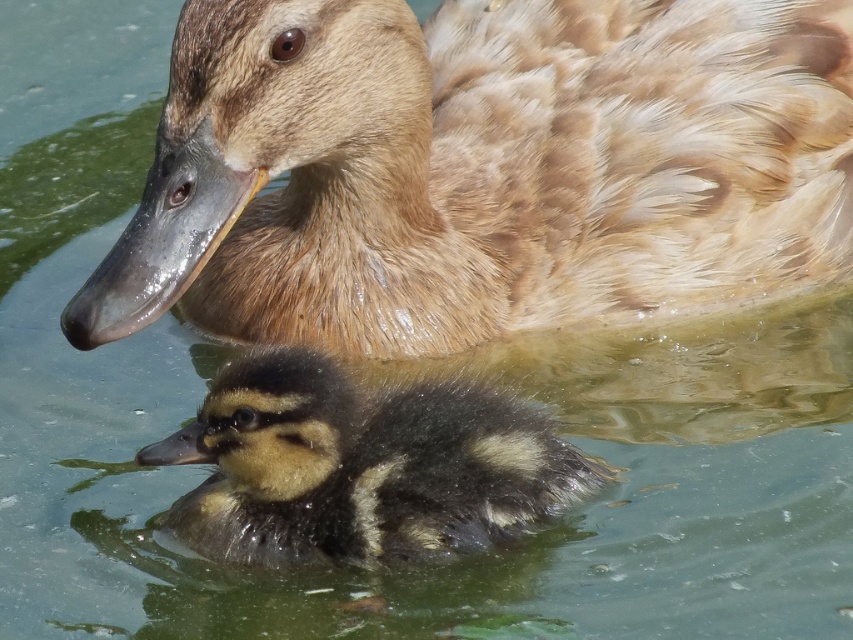
From the picture: You are a photographer trying to capture the brown feathered duck at upper center in the center of your photo. The duck is currently located at point (480, 168). To center it, should you move your camera to the left or right?

The brown feathered duck at upper center is located at point (480, 168). Since the x coordinate is 0.263, which is less than 0.5, you should move your camera to the right to center it.

You are observing a duck and its duckling in the water. The brown feathered duck at upper center and the black fuzzy duckling at center are both in the scene. Which one is positioned higher in the image?

The brown feathered duck at upper center is positioned higher in the image than the black fuzzy duckling at center.

You are standing on the edge of a pond and see the brown feathered duck at upper center. If you want to toss a small pebble to reach the duck, and the pebble can travel 1.5 meters, will it reach the duck?

The brown feathered duck at upper center is 1.56 meters away from the viewer. Since the pebble can only travel 1.5 meters, it will not reach the duck.